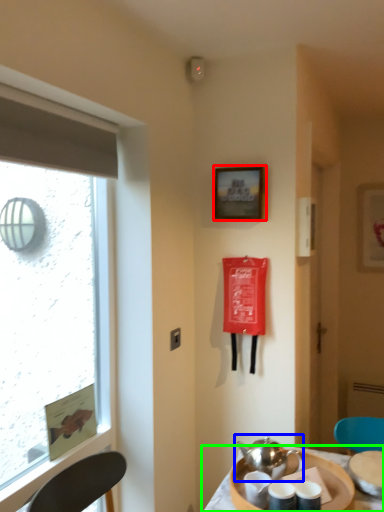
Question: Estimate the real-world distances between objects in this image. Which object is closer to picture frame (highlighted by a red box), tea set (highlighted by a blue box) or table (highlighted by a green box)?

Choices:
 (A) tea set
 (B) table

Answer: (A)